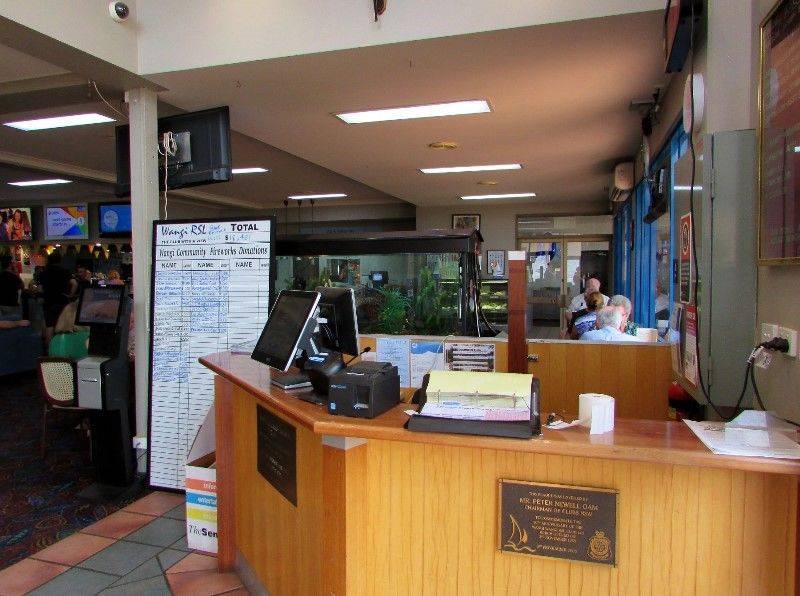
Locate an element on the screen. The height and width of the screenshot is (596, 800). aquarium is located at coordinates (406, 265).